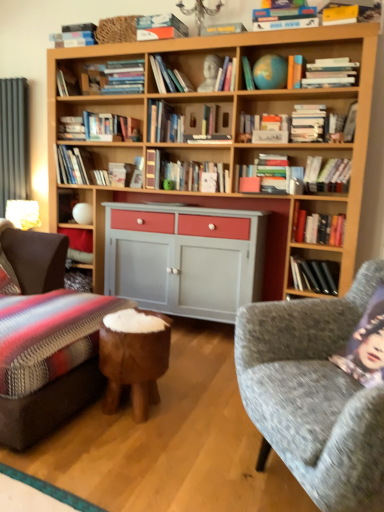
Question: Is green matte globe at upper center, the 3th book in the left-to-right sequence, closer to the viewer compared to matte green book at center, which is counted as the 5th magazine, starting from the top?

Choices:
 (A) yes
 (B) no

Answer: (A)

Question: Can you confirm if green matte globe at upper center, the 3th book in the left-to-right sequence, is thinner than matte green book at center, the first magazine ordered from the bottom?

Choices:
 (A) yes
 (B) no

Answer: (B)

Question: Does green matte globe at upper center, the 3th book in the left-to-right sequence, have a greater height compared to matte green book at center, which is counted as the 5th magazine, starting from the top?

Choices:
 (A) no
 (B) yes

Answer: (A)

Question: Is green matte globe at upper center, which is the fourth book in right-to-left order, to the right of matte green book at center, the first magazine ordered from the bottom, from the viewer's perspective?

Choices:
 (A) no
 (B) yes

Answer: (A)

Question: Does green matte globe at upper center, which is counted as the 5th book, starting from the bottom, lie behind matte green book at center, the first magazine ordered from the bottom?

Choices:
 (A) yes
 (B) no

Answer: (B)

Question: Does green matte globe at upper center, which is the fourth book in right-to-left order, have a larger size compared to matte green book at center, the first magazine ordered from the bottom?

Choices:
 (A) yes
 (B) no

Answer: (B)

Question: From a real-world perspective, is polished wood stool at center beneath matte gold table lamp at left?

Choices:
 (A) no
 (B) yes

Answer: (B)

Question: Can you confirm if polished wood stool at center is taller than matte gold table lamp at left?

Choices:
 (A) yes
 (B) no

Answer: (A)

Question: Is polished wood stool at center smaller than matte gold table lamp at left?

Choices:
 (A) no
 (B) yes

Answer: (A)

Question: Is polished wood stool at center not near matte gold table lamp at left?

Choices:
 (A) no
 (B) yes

Answer: (B)

Question: From a real-world perspective, is polished wood stool at center physically above matte gold table lamp at left?

Choices:
 (A) no
 (B) yes

Answer: (A)

Question: Can you confirm if polished wood stool at center is positioned to the right of matte gold table lamp at left?

Choices:
 (A) no
 (B) yes

Answer: (B)

Question: From the image's perspective, is matte green book at center, the first magazine ordered from the bottom, on yellow paper magazine at upper right, marked as the second magazine in a top-to-bottom arrangement?

Choices:
 (A) no
 (B) yes

Answer: (A)